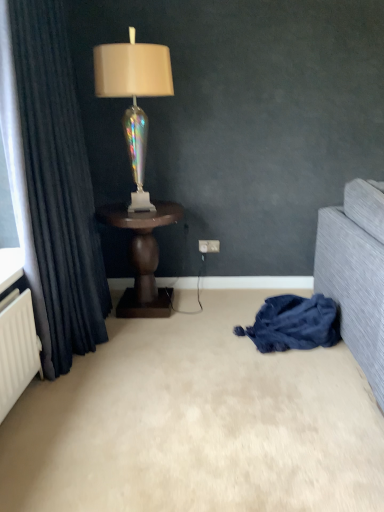
What do you see at coordinates (209, 246) in the screenshot?
I see `white plastic electric outlet at center` at bounding box center [209, 246].

Where is `dark blue fabric at lower right`? dark blue fabric at lower right is located at coordinates (294, 323).

Could you tell me if beige carpet at lower center is turned towards dark blue fabric at lower right?

No, beige carpet at lower center is not turned towards dark blue fabric at lower right.

Considering the positions of points (306, 454) and (326, 322), is point (306, 454) farther from camera compared to point (326, 322)?

No, (306, 454) is closer to viewer.

Where is `plain that appears below the dark blue fabric at lower right (from a real-world perspective)`? Image resolution: width=384 pixels, height=512 pixels. plain that appears below the dark blue fabric at lower right (from a real-world perspective) is located at coordinates (196, 423).

What's the angular difference between white plastic electric outlet at center and dark wood side table at center's facing directions?

The angular difference between white plastic electric outlet at center and dark wood side table at center is 0.0155 degrees.

Between white plastic electric outlet at center and dark wood side table at center, which one is positioned behind?

white plastic electric outlet at center is behind.

Is white plastic electric outlet at center positioned with its back to dark wood side table at center?

white plastic electric outlet at center does not have its back to dark wood side table at center.

Considering the relative sizes of white plastic electric outlet at center and dark wood side table at center in the image provided, is white plastic electric outlet at center thinner than dark wood side table at center?

Yes.

At what (x,y) coordinates should I click in order to perform the action: click on electric outlet behind the dark blue textured curtain at left. Please return your answer as a coordinate pair (x, y). Looking at the image, I should click on tap(209, 246).

Who is more distant, white plastic electric outlet at center or dark blue textured curtain at left?

white plastic electric outlet at center is more distant.

How far apart are white plastic electric outlet at center and dark blue textured curtain at left?

1.18 meters.

Which point is more forward, (202, 252) or (54, 218)?

The point (54, 218) is in front.

How many degrees apart are the facing directions of dark blue textured curtain at left and beige carpet at lower center?

The angular difference between dark blue textured curtain at left and beige carpet at lower center is 92.1 degrees.

From the image's perspective, does dark blue textured curtain at left appear lower than beige carpet at lower center?

No, from the image's perspective, dark blue textured curtain at left is not beneath beige carpet at lower center.

Would you say dark blue textured curtain at left is inside or outside beige carpet at lower center?

dark blue textured curtain at left is not inside beige carpet at lower center, it's outside.

Is point (101, 64) positioned behind point (329, 328)?

Yes.

Who is bigger, iridescent glass lamp at center or dark blue fabric at lower right?

Bigger between the two is iridescent glass lamp at center.

From a real-world perspective, who is located lower, iridescent glass lamp at center or dark blue fabric at lower right?

dark blue fabric at lower right, from a real-world perspective.

Is dark blue fabric at lower right located within iridescent glass lamp at center?

Definitely not — dark blue fabric at lower right is not inside iridescent glass lamp at center.

From the image's perspective, is iridescent glass lamp at center positioned above or below dark wood side table at center?

Based on their image positions, iridescent glass lamp at center is located above dark wood side table at center.

Is iridescent glass lamp at center looking in the opposite direction of dark wood side table at center?

No, iridescent glass lamp at center is not facing the opposite direction of dark wood side table at center.

Is iridescent glass lamp at center in front of or behind dark wood side table at center in the image?

Clearly, iridescent glass lamp at center is in front of dark wood side table at center.

Consider the image. Which point is more forward, (97, 64) or (151, 280)?

The point (97, 64) is in front.

How different are the orientations of dark wood side table at center and white plastic electric outlet at center in degrees?

0.0155 degrees separate the facing orientations of dark wood side table at center and white plastic electric outlet at center.

Is dark wood side table at center further to the viewer compared to white plastic electric outlet at center?

No, it is in front of white plastic electric outlet at center.

From a real-world perspective, which is physically above, dark wood side table at center or white plastic electric outlet at center?

In real-world perspective, dark wood side table at center is above.

Considering the positions of objects dark wood side table at center and white plastic electric outlet at center in the image provided, who is more to the right, dark wood side table at center or white plastic electric outlet at center?

white plastic electric outlet at center is more to the right.

This screenshot has width=384, height=512. What are the coordinates of `plain lying in front of the dark blue fabric at lower right` in the screenshot? It's located at (196, 423).

Locate an element on the screen. This screenshot has height=512, width=384. electric outlet above the dark wood side table at center (from the image's perspective) is located at coordinates (209, 246).

Consider the image. Looking at the image, which one is located further to iridescent glass lamp at center, dark blue fabric at lower right or white plastic electric outlet at center?

dark blue fabric at lower right is positioned further to the anchor iridescent glass lamp at center.

From the image, which object appears to be farther from beige carpet at lower center, white plastic electric outlet at center or dark blue fabric at lower right?

Among the two, white plastic electric outlet at center is located further to beige carpet at lower center.

Which object lies nearer to the anchor point iridescent glass lamp at center, dark blue textured curtain at left or dark wood side table at center?

Based on the image, dark blue textured curtain at left appears to be nearer to iridescent glass lamp at center.

Based on their spatial positions, is dark wood side table at center or dark blue fabric at lower right closer to white plastic electric outlet at center?

The object closer to white plastic electric outlet at center is dark wood side table at center.

Looking at the image, which one is located further to beige carpet at lower center, dark blue textured curtain at left or dark wood side table at center?

dark wood side table at center.

Estimate the real-world distances between objects in this image. Which object is closer to white plastic electric outlet at center, beige carpet at lower center or dark wood side table at center?

Based on the image, dark wood side table at center appears to be nearer to white plastic electric outlet at center.

From the image, which object appears to be farther from dark blue textured curtain at left, iridescent glass lamp at center or beige carpet at lower center?

beige carpet at lower center lies further to dark blue textured curtain at left than the other object.

Considering their positions, is dark blue textured curtain at left positioned closer to beige carpet at lower center than white plastic electric outlet at center?

dark blue textured curtain at left lies closer to beige carpet at lower center than the other object.

The height and width of the screenshot is (512, 384). Identify the location of table between beige carpet at lower center and white plastic electric outlet at center along the z-axis. (142, 256).

This screenshot has width=384, height=512. I want to click on blanket between dark blue textured curtain at left and beige carpet at lower center in the vertical direction, so pyautogui.click(x=294, y=323).

Image resolution: width=384 pixels, height=512 pixels. I want to click on electric outlet between iridescent glass lamp at center and dark blue fabric at lower right vertically, so click(209, 246).

Image resolution: width=384 pixels, height=512 pixels. Find the location of `lamp between dark blue textured curtain at left and dark blue fabric at lower right from left to right`. lamp between dark blue textured curtain at left and dark blue fabric at lower right from left to right is located at coordinates (134, 97).